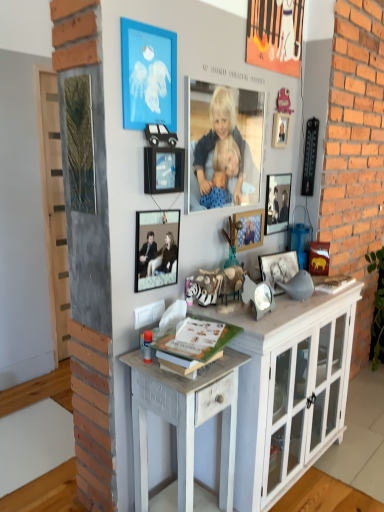
What is the approximate width of white distressed wood desk at center?

The width of white distressed wood desk at center is 14.42 inches.

The image size is (384, 512). What do you see at coordinates (156, 249) in the screenshot? I see `metallic silver frame at center, which is counted as the 2th picture frame, starting from the left` at bounding box center [156, 249].

Where is `wooden photo frame at upper center, the fourth picture frame from the left`? The height and width of the screenshot is (512, 384). wooden photo frame at upper center, the fourth picture frame from the left is located at coordinates (249, 229).

This screenshot has height=512, width=384. What do you see at coordinates (249, 229) in the screenshot?
I see `wooden photo frame at upper center, acting as the third picture frame starting from the right` at bounding box center [249, 229].

Measure the distance between metallic silver picture frame at upper center, the fourth picture frame when ordered from right to left, and camera.

metallic silver picture frame at upper center, the fourth picture frame when ordered from right to left, and camera are 4.91 feet apart from each other.

Find the location of a particular element. The width and height of the screenshot is (384, 512). white distressed wood desk at center is located at coordinates (185, 419).

From a real-world perspective, is black matte picture frame at center, which is the 2th picture frame from right to left, positioned above or below metallic silver frame at center, which is counted as the 2th picture frame, starting from the left?

In terms of real-world spatial position, black matte picture frame at center, which is the 2th picture frame from right to left, is below metallic silver frame at center, which is counted as the 2th picture frame, starting from the left.

Which of these two, black matte picture frame at center, which is the 2th picture frame from right to left, or metallic silver frame at center, which is counted as the 2th picture frame, starting from the left, stands taller?

Standing taller between the two is metallic silver frame at center, which is counted as the 2th picture frame, starting from the left.

Are black matte picture frame at center, which is the 2th picture frame from right to left, and metallic silver frame at center, which is counted as the 5th picture frame, starting from the right, beside each other?

black matte picture frame at center, which is the 2th picture frame from right to left, is not next to metallic silver frame at center, which is counted as the 5th picture frame, starting from the right, and they're not touching.

Considering the points (270, 278) and (147, 228), which point is behind, point (270, 278) or point (147, 228)?

The point (270, 278) is more distant.

From the image's perspective, is metallic silver photo frame at center, placed as the first picture frame when sorted from right to left, positioned above or below black matte picture frame at center, which is the 2th picture frame from right to left?

From the image's perspective, metallic silver photo frame at center, placed as the first picture frame when sorted from right to left, appears above black matte picture frame at center, which is the 2th picture frame from right to left.

Which object is thinner, metallic silver photo frame at center, placed as the first picture frame when sorted from right to left, or black matte picture frame at center, the fifth picture frame viewed from the left?

With smaller width is metallic silver photo frame at center, placed as the first picture frame when sorted from right to left.

Is the position of metallic silver photo frame at center, which ranks as the 6th picture frame in left-to-right order, less distant than that of black matte picture frame at center, the fifth picture frame viewed from the left?

That is False.

From a real-world perspective, is metallic silver photo frame at center, placed as the first picture frame when sorted from right to left, above or below black matte picture frame at center, the fifth picture frame viewed from the left?

Clearly, from a real-world perspective, metallic silver photo frame at center, placed as the first picture frame when sorted from right to left, is above black matte picture frame at center, the fifth picture frame viewed from the left.

From the image's perspective, is white painted wood cabinet at center beneath wooden photo frame at upper center, the fourth picture frame from the left?

Yes, from the image's perspective, white painted wood cabinet at center is below wooden photo frame at upper center, the fourth picture frame from the left.

Between white painted wood cabinet at center and wooden photo frame at upper center, acting as the third picture frame starting from the right, which one has less height?

wooden photo frame at upper center, acting as the third picture frame starting from the right.

Does point (311, 378) appear closer or farther from the camera than point (252, 227)?

Point (311, 378) is closer to the camera than point (252, 227).

Which is nearer, (281, 225) or (225, 469)?

Point (281, 225) is positioned farther from the camera compared to point (225, 469).

Which is correct: metallic silver photo frame at center, placed as the first picture frame when sorted from right to left, is inside white distressed wood desk at center, or outside of it?

metallic silver photo frame at center, placed as the first picture frame when sorted from right to left, is outside white distressed wood desk at center.

Image resolution: width=384 pixels, height=512 pixels. I want to click on desk on the left of metallic silver photo frame at center, which ranks as the 6th picture frame in left-to-right order, so click(185, 419).

At what (x,y) coordinates should I click in order to perform the action: click on person lying on the right of green matte book at center. Please return your answer as a coordinate pair (x, y). The width and height of the screenshot is (384, 512). Looking at the image, I should click on (225, 141).

Who is smaller, green matte book at center or smooth blue fabric at center?

green matte book at center is smaller.

Which object is positioned more to the left, green matte book at center or smooth blue fabric at center?

From the viewer's perspective, green matte book at center appears more on the left side.

Could you tell me if green matte book at center is facing smooth blue fabric at center?

No, green matte book at center does not turn towards smooth blue fabric at center.

Based on the photo, who is shorter, white painted wood cabinet at center or metallic silver frame at center, which is counted as the 5th picture frame, starting from the right?

metallic silver frame at center, which is counted as the 5th picture frame, starting from the right.

From the white painted wood cabinet at center, count 1st picture frames backward and point to it. Please provide its 2D coordinates.

[(156, 249)]

Is white painted wood cabinet at center aimed at metallic silver frame at center, which is counted as the 5th picture frame, starting from the right?

No, white painted wood cabinet at center is not oriented towards metallic silver frame at center, which is counted as the 5th picture frame, starting from the right.

From the picture: Is white painted wood cabinet at center located outside metallic silver frame at center, which is counted as the 5th picture frame, starting from the right?

Yes, white painted wood cabinet at center is not within metallic silver frame at center, which is counted as the 5th picture frame, starting from the right.

Image resolution: width=384 pixels, height=512 pixels. I want to click on picture frame that is the 2nd one when counting rightward from the white painted wood cabinet at center, so click(277, 202).

Is point (286, 453) in front of point (274, 201)?

Yes, point (286, 453) is in front of point (274, 201).

Is white painted wood cabinet at center spatially inside metallic silver photo frame at center, placed as the first picture frame when sorted from right to left, or outside of it?

white painted wood cabinet at center is not enclosed by metallic silver photo frame at center, placed as the first picture frame when sorted from right to left.

Locate an element on the screen. This screenshot has width=384, height=512. the 3rd picture frame to the right of the metallic silver frame at center, which is counted as the 5th picture frame, starting from the right, starting your count from the anchor is located at coordinates (278, 268).

Locate an element on the screen. This screenshot has height=512, width=384. the 3rd picture frame located above the black matte picture frame at center, which is the 2th picture frame from right to left (from a real-world perspective) is located at coordinates (277, 202).

From the picture: From the image, which object appears to be nearer to metallic silver picture frame at upper center, the fourth picture frame when ordered from right to left, metallic silver photo frame at center, placed as the first picture frame when sorted from right to left, or metallic silver frame at center, which is counted as the 2th picture frame, starting from the left?

Based on the image, metallic silver frame at center, which is counted as the 2th picture frame, starting from the left, appears to be nearer to metallic silver picture frame at upper center, the fourth picture frame when ordered from right to left.

Considering their positions, is wooden photo frame at upper center, acting as the third picture frame starting from the right, positioned further to white distressed wood desk at center than blue matte picture frame at upper center, which is counted as the sixth picture frame, starting from the right?

blue matte picture frame at upper center, which is counted as the sixth picture frame, starting from the right.

Looking at the image, which one is located further to green matte book at center, metallic silver photo frame at center, placed as the first picture frame when sorted from right to left, or white distressed wood desk at center?

The object further to green matte book at center is metallic silver photo frame at center, placed as the first picture frame when sorted from right to left.

Considering their positions, is white painted wood cabinet at center positioned closer to metallic silver frame at center, which is counted as the 5th picture frame, starting from the right, than white distressed wood desk at center?

The object closer to metallic silver frame at center, which is counted as the 5th picture frame, starting from the right, is white distressed wood desk at center.

Looking at the image, which one is located further to green matte book at center, white distressed wood desk at center or metallic silver picture frame at upper center, the fourth picture frame when ordered from right to left?

metallic silver picture frame at upper center, the fourth picture frame when ordered from right to left, is positioned further to the anchor green matte book at center.

Estimate the real-world distances between objects in this image. Which object is closer to blue matte picture frame at upper center, which is counted as the sixth picture frame, starting from the right, wooden photo frame at upper center, acting as the third picture frame starting from the right, or metallic silver picture frame at upper center, acting as the 3th picture frame starting from the left?

Based on the image, metallic silver picture frame at upper center, acting as the 3th picture frame starting from the left, appears to be nearer to blue matte picture frame at upper center, which is counted as the sixth picture frame, starting from the right.

When comparing their distances from white distressed wood desk at center, does white painted wood cabinet at center or metallic silver photo frame at center, placed as the first picture frame when sorted from right to left, seem further?

Based on the image, metallic silver photo frame at center, placed as the first picture frame when sorted from right to left, appears to be further to white distressed wood desk at center.

Estimate the real-world distances between objects in this image. Which object is further from green matte book at center, metallic silver frame at center, which is counted as the 5th picture frame, starting from the right, or metallic silver picture frame at upper center, acting as the 3th picture frame starting from the left?

metallic silver picture frame at upper center, acting as the 3th picture frame starting from the left, lies further to green matte book at center than the other object.

Image resolution: width=384 pixels, height=512 pixels. I want to click on magazine located between white distressed wood desk at center and white painted wood cabinet at center in the left-right direction, so click(x=194, y=345).

Locate an element on the screen. Image resolution: width=384 pixels, height=512 pixels. magazine between metallic silver picture frame at upper center, acting as the 3th picture frame starting from the left, and white distressed wood desk at center vertically is located at coordinates (194, 345).

Identify the location of cabinetry between blue matte picture frame at upper center, which is counted as the sixth picture frame, starting from the right, and white distressed wood desk at center vertically. (289, 390).

Where is `person between blue matte picture frame at upper center, which is counted as the first picture frame, starting from the left, and metallic silver photo frame at center, placed as the first picture frame when sorted from right to left, from front to back`? person between blue matte picture frame at upper center, which is counted as the first picture frame, starting from the left, and metallic silver photo frame at center, placed as the first picture frame when sorted from right to left, from front to back is located at coordinates (225, 141).